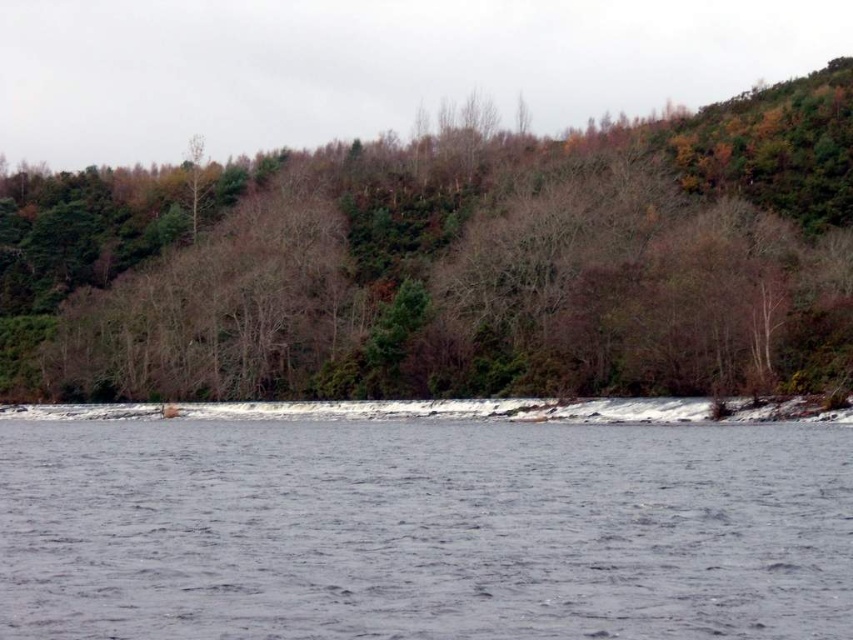
You are a hiker standing at the edge of the water. You see the brown leafless tree at center and the gray water at center. Which object is closer to you?

The brown leafless tree at center is closer to you because the gray water at center is behind it.

You are standing on the edge of the water and want to take a photo of both the brown leafless tree at center and the gray water at center. Which object will appear taller in your camera view?

The brown leafless tree at center is taller than the gray water at center, so it will appear taller in your camera view.

From the picture: What are the coordinates of the brown leafless tree at center in the image?

The brown leafless tree at center is located at coordinates [456,264].